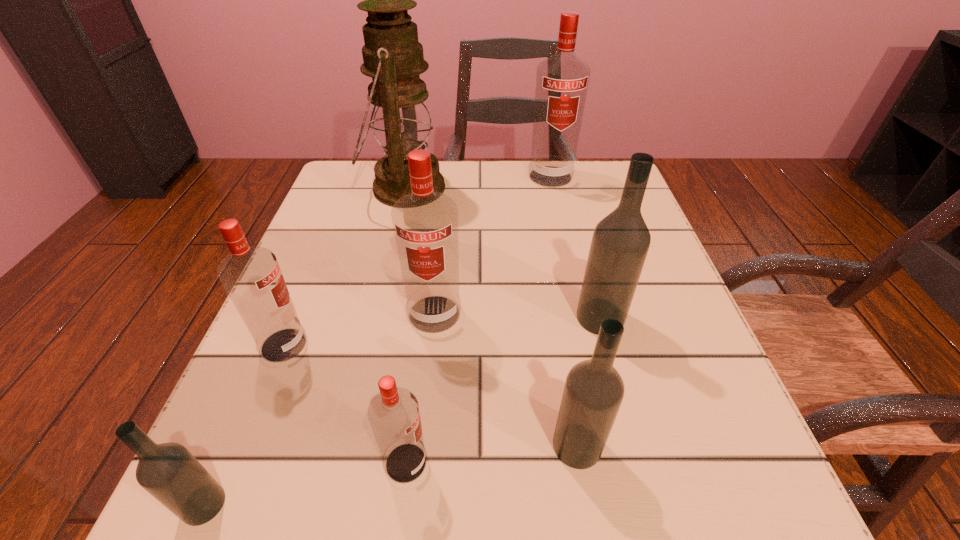
In order to click on oil lamp in this screenshot , I will do `click(401, 122)`.

Identify the location of the tallest vodka. (562, 80).

In order to click on the biggest red vodka in this screenshot , I will do `click(562, 80)`.

This screenshot has width=960, height=540. I want to click on the farthest black vodka, so click(620, 243).

At what (x,y) coordinates should I click in order to perform the action: click on the rightmost black vodka. Please return your answer as a coordinate pair (x, y). The image size is (960, 540). Looking at the image, I should click on (620, 243).

Locate an element on the screen. The height and width of the screenshot is (540, 960). the second biggest red vodka is located at coordinates (425, 223).

Where is `the leftmost red vodka`? the leftmost red vodka is located at coordinates (251, 276).

Where is `the second biggest black vodka`? the second biggest black vodka is located at coordinates (593, 392).

Where is `the second black vodka from left to right`? the second black vodka from left to right is located at coordinates (593, 392).

The image size is (960, 540). In order to click on the smallest red vodka in this screenshot , I will do click(x=394, y=416).